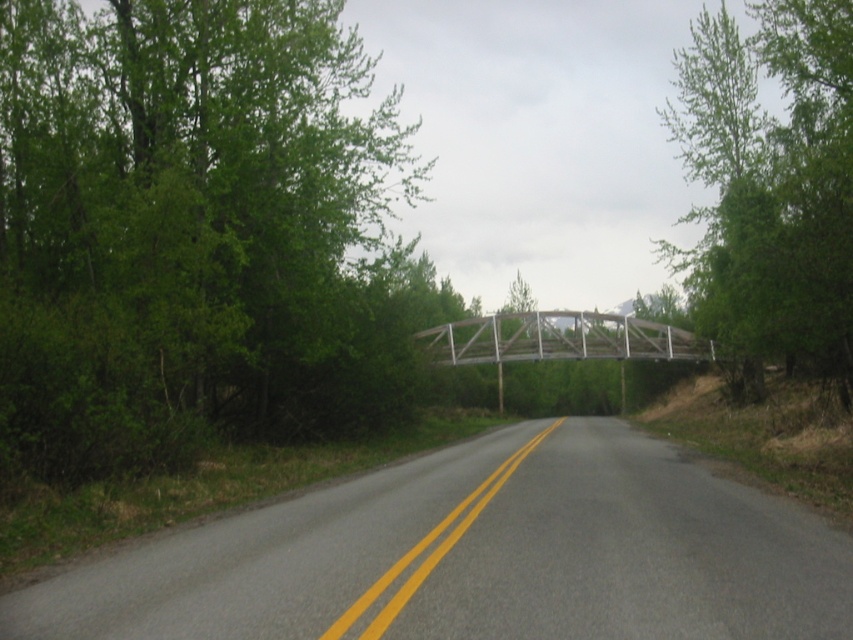
Does point (544, 538) come in front of point (688, 65)?

Yes, it is.

Is asphalt road at center wider than green leafy tree at right?

No, asphalt road at center is not wider than green leafy tree at right.

Identify the location of asphalt road at center. (479, 556).

Is green leafy tree at left smaller than green leafy tree at right?

Yes, green leafy tree at left is smaller than green leafy tree at right.

The width and height of the screenshot is (853, 640). Describe the element at coordinates (193, 232) in the screenshot. I see `green leafy tree at left` at that location.

This screenshot has height=640, width=853. What are the coordinates of `green leafy tree at left` in the screenshot? It's located at (193, 232).

Between green leafy tree at left and asphalt road at center, which one is positioned lower?

asphalt road at center

Identify the location of green leafy tree at left. This screenshot has width=853, height=640. (193, 232).

Which is in front, point (39, 198) or point (718, 588)?

Point (718, 588) is more forward.

Where is `green leafy tree at left`? This screenshot has width=853, height=640. green leafy tree at left is located at coordinates (193, 232).